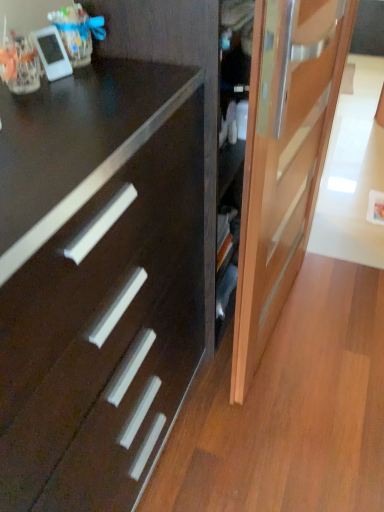
Identify the location of unoccupied region to the right of light brown wooden door at right. The height and width of the screenshot is (512, 384). (338, 317).